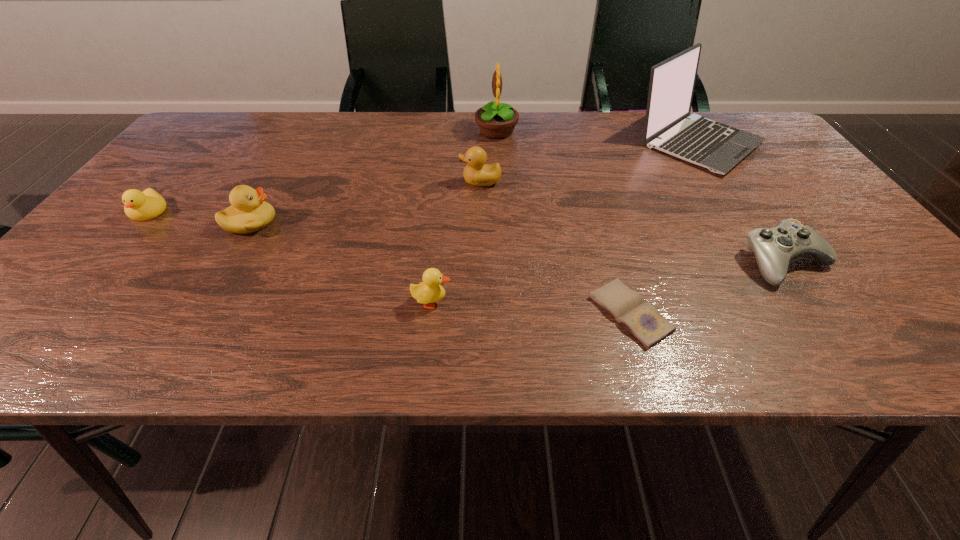
This screenshot has width=960, height=540. I want to click on free spot at the far edge of the desktop, so click(303, 118).

I want to click on free region at the near edge, so 326,320.

In the image, there is a desktop. Where is `free space at the left edge`? free space at the left edge is located at coordinates (135, 272).

The image size is (960, 540). Identify the location of free spot at the right edge of the desktop. (769, 212).

The height and width of the screenshot is (540, 960). In order to click on free space at the far left corner of the desktop in this screenshot , I will do `click(247, 134)`.

Image resolution: width=960 pixels, height=540 pixels. Find the location of `blank region between the leftmost duckling and the third duckling from left to right`. blank region between the leftmost duckling and the third duckling from left to right is located at coordinates (290, 257).

The image size is (960, 540). Identify the location of vacant space that is in between the rightmost duckling and the nearest duckling. (456, 242).

The image size is (960, 540). Find the location of `vacant space that's between the second duckling from left to right and the control`. vacant space that's between the second duckling from left to right and the control is located at coordinates (518, 242).

Find the location of `vacant region between the farthest duckling and the leftmost object`. vacant region between the farthest duckling and the leftmost object is located at coordinates (314, 197).

What are the coordinates of `vacant space in between the seventh object from right to left and the farthest duckling` in the screenshot? It's located at (366, 202).